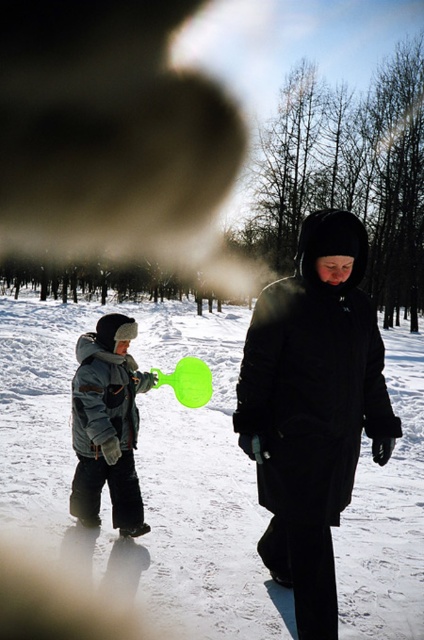
Where is `white fluffy snow at center`? white fluffy snow at center is located at coordinates (144, 465).

Which is in front, point (223, 524) or point (122, 477)?

Point (122, 477) is more forward.

Between point (67, 385) and point (91, 358), which one is positioned in front?

Positioned in front is point (91, 358).

At what (x,y) coordinates should I click in order to perform the action: click on white fluffy snow at center. Please return your answer as a coordinate pair (x, y). Looking at the image, I should click on (144, 465).